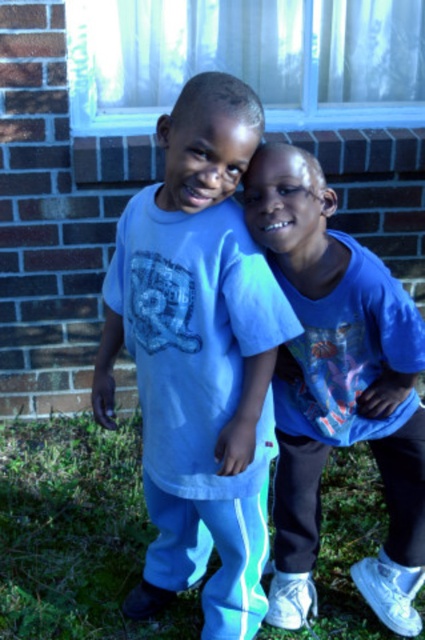
Between matte blue t-shirt at center and green grass at lower center, which one is positioned higher?

Positioned higher is matte blue t-shirt at center.

Does point (285, 358) come in front of point (8, 608)?

Yes, point (285, 358) is closer to viewer.

Locate an element on the screen. The width and height of the screenshot is (425, 640). matte blue t-shirt at center is located at coordinates (339, 388).

Between light blue cotton shirt at center and green grass at lower center, which one has more height?

With more height is light blue cotton shirt at center.

Can you confirm if light blue cotton shirt at center is shorter than green grass at lower center?

Incorrect, light blue cotton shirt at center's height does not fall short of green grass at lower center's.

Is point (227, 390) more distant than point (8, 456)?

That is False.

The image size is (425, 640). What are the coordinates of `light blue cotton shirt at center` in the screenshot? It's located at (198, 358).

Does light blue cotton shirt at center come in front of matte blue t-shirt at center?

That is True.

Does point (206, 300) come closer to viewer compared to point (388, 452)?

That is True.

This screenshot has width=425, height=640. I want to click on light blue cotton shirt at center, so click(198, 358).